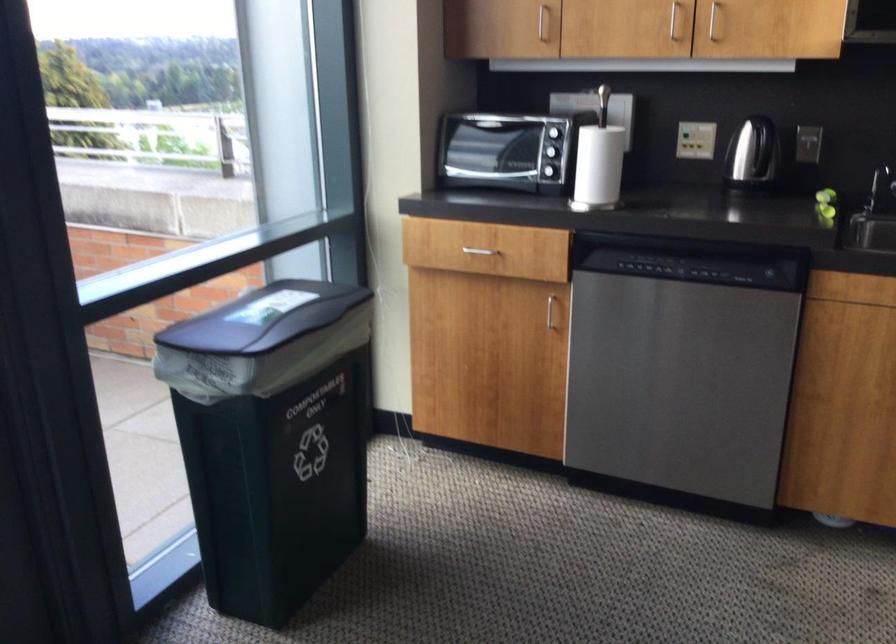
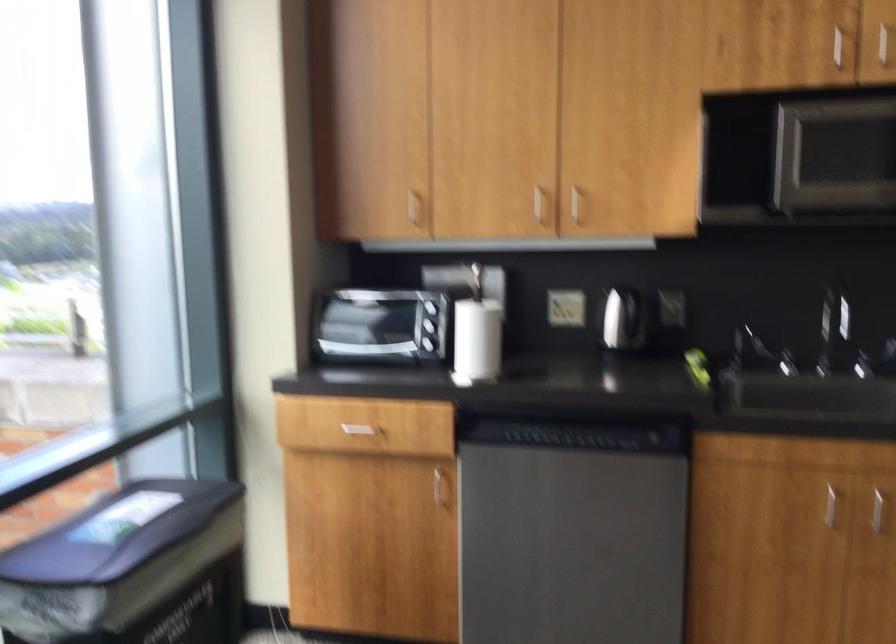
Question: How did the camera likely rotate?

Choices:
 (A) Left
 (B) Right
 (C) Up
 (D) Down

Answer: (C)